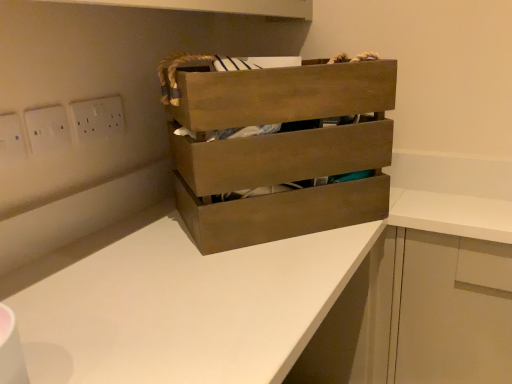
The width and height of the screenshot is (512, 384). I want to click on free region on the left part of wooden crate at center, so click(111, 244).